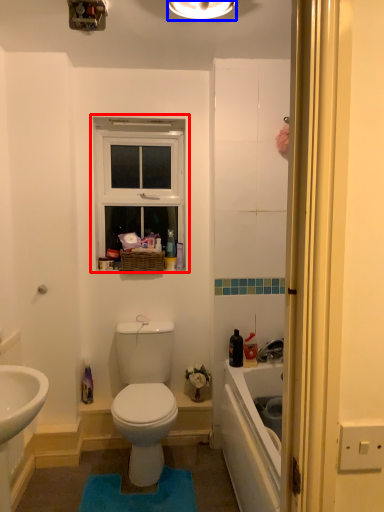
Question: Which object is closer to the camera taking this photo, window (highlighted by a red box) or light fixture (highlighted by a blue box)?

Choices:
 (A) window
 (B) light fixture

Answer: (B)